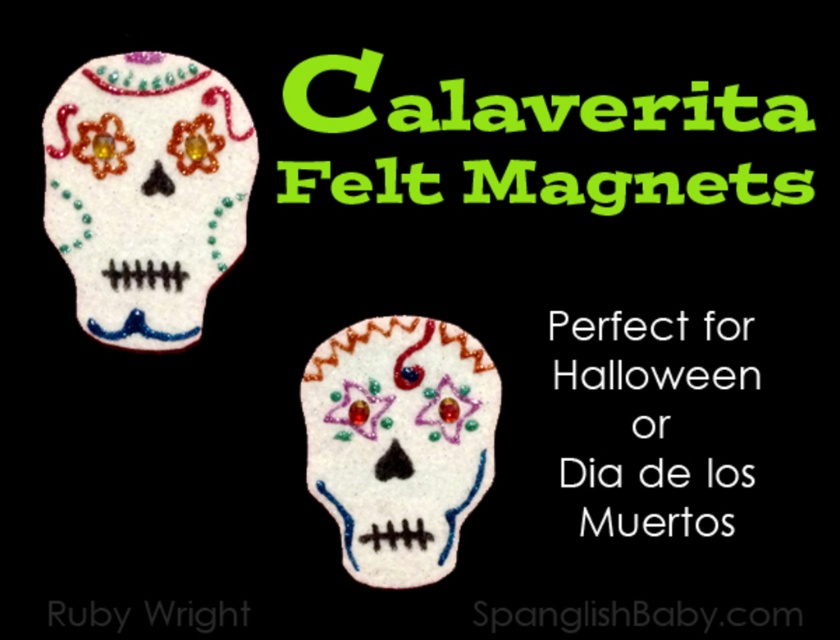
You are an art curator planning to display two white felt skulls on a wall. The skulls are labeled as the white felt skull at upper left and the white felt skull at center. Given their sizes, which skull should you place higher up to maintain visual balance?

The white felt skull at upper left is taller than the white felt skull at center. To maintain visual balance, place the taller white felt skull at upper left lower down and the smaller white felt skull at center higher up so their visual weights balance each other.

You are looking at the two decorative skull magnets in the image. Based on their positions, which point, point (85, 285) or point (363, 340), is closer to you?

Point (85, 285) is in front of point (363, 340), so it is closer to you.

In the scene shown: You are an interior designer arranging two white felt skulls on a blackboard wall. The white felt skull at upper left and the white felt skull at center are placed such that one is in front of the other. Which skull is closer to the observer?

The white felt skull at upper left is closer to the observer because it is in front of the white felt skull at center.